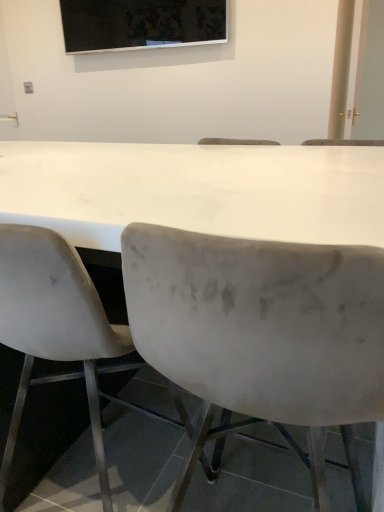
Question: Looking at their shapes, would you say white glossy door at upper right is wider or thinner than black glossy screen at upper center?

Choices:
 (A) wide
 (B) thin

Answer: (B)

Question: Is white glossy door at upper right bigger or smaller than black glossy screen at upper center?

Choices:
 (A) big
 (B) small

Answer: (A)

Question: Which of these objects is positioned closest to the velvet gray chair at center, which is counted as the 1th chair, starting from the right?

Choices:
 (A) white glossy door at upper right
 (B) black glossy screen at upper center
 (C) white matte chair at left, arranged as the 2th chair when viewed from the right

Answer: (C)

Question: Which is nearer to the black glossy screen at upper center?

Choices:
 (A) velvet gray chair at center, the second chair when ordered from left to right
 (B) white glossy door at upper right
 (C) white matte chair at left, arranged as the 2th chair when viewed from the right

Answer: (B)